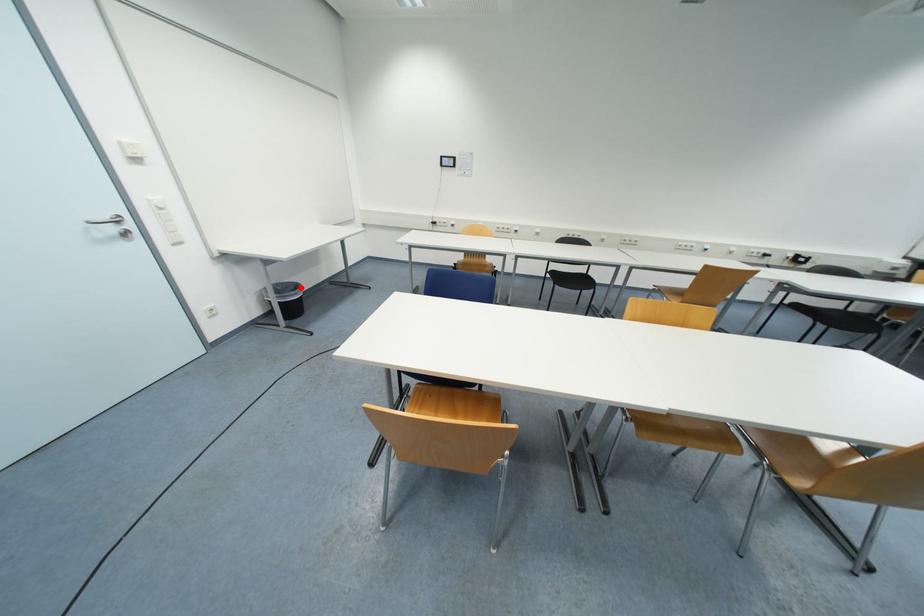
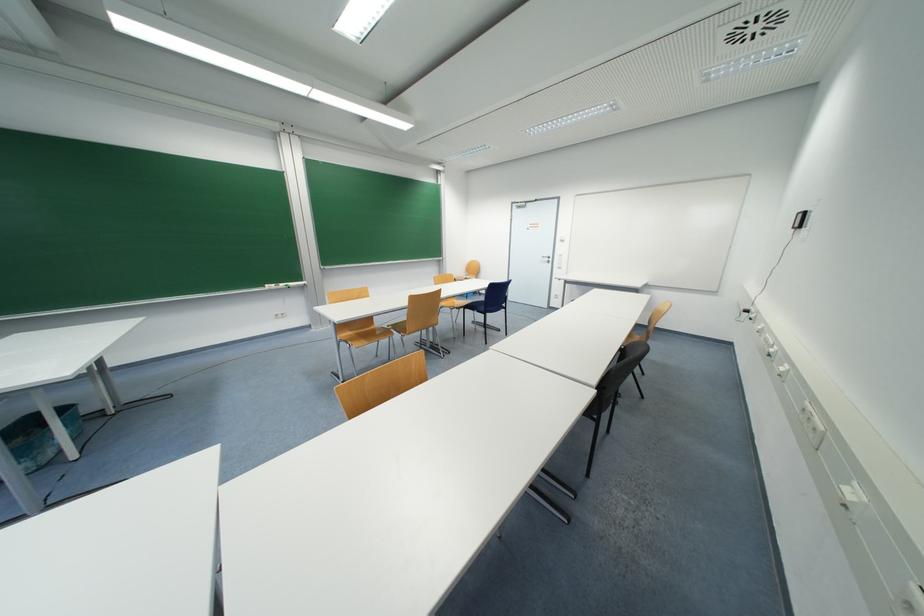
Question: I am providing you with two images of the same scene from different viewpoints. A red point is marked on the first image. At the location where the point appears in image 1, is it still visible in image 2?

Choices:
 (A) Yes
 (B) No

Answer: (B)